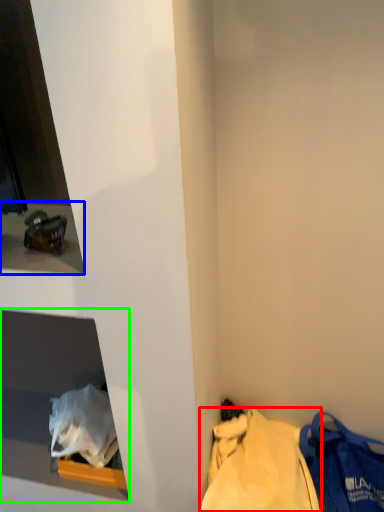
Question: Which object is positioned closest to tote bag (highlighted by a red box)? Select from window sill (highlighted by a blue box) and cabinet (highlighted by a green box).

Choices:
 (A) window sill
 (B) cabinet

Answer: (B)